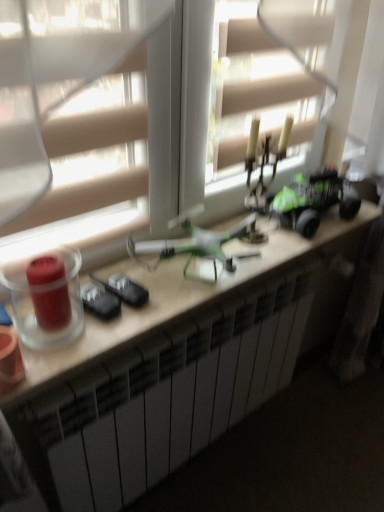
Locate an element on the screen. The image size is (384, 512). free space to the right of transparent glass candle at left, arranged as the 1th candle holder when viewed from the left is located at coordinates (107, 334).